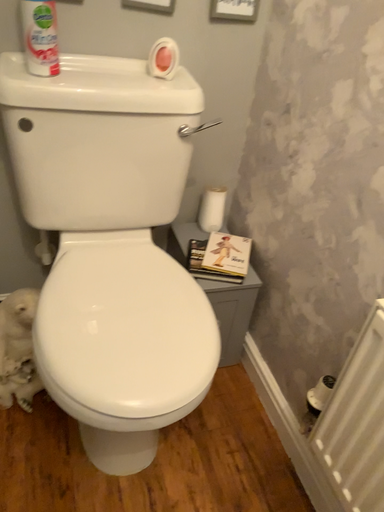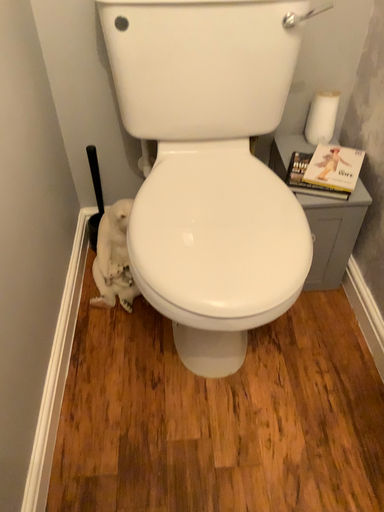
Question: Which way did the camera rotate in the video?

Choices:
 (A) rotated upward
 (B) rotated downward

Answer: (B)